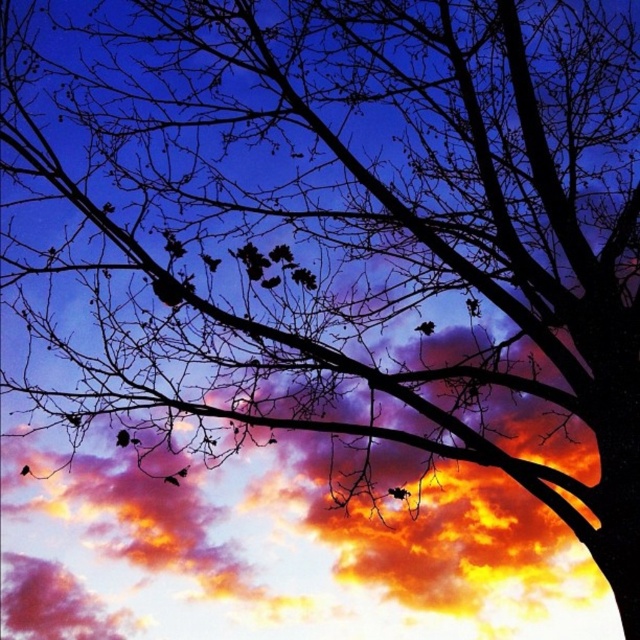
Question: Is black matte bird at center behind silhouette feather at lower left?

Choices:
 (A) no
 (B) yes

Answer: (B)

Question: Which point is closer to the camera?

Choices:
 (A) black matte bird at center
 (B) silhouette feather at lower left

Answer: (B)

Question: Does black matte bird at center lie in front of silhouette feather at lower left?

Choices:
 (A) no
 (B) yes

Answer: (A)

Question: Which of the following is the farthest from the observer?

Choices:
 (A) (22, 472)
 (B) (428, 323)

Answer: (B)

Question: Does black matte bird at center have a larger size compared to silhouette feather at lower left?

Choices:
 (A) yes
 (B) no

Answer: (A)